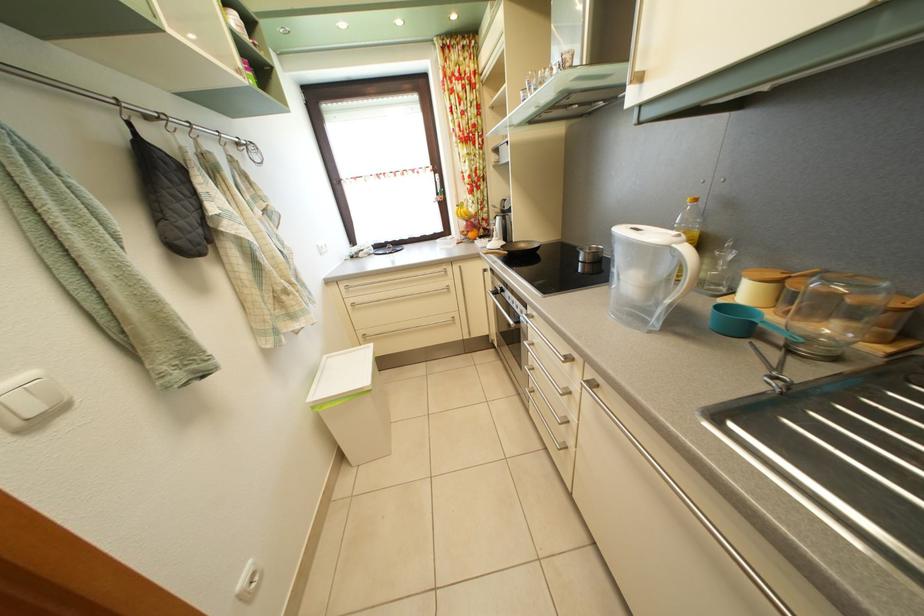
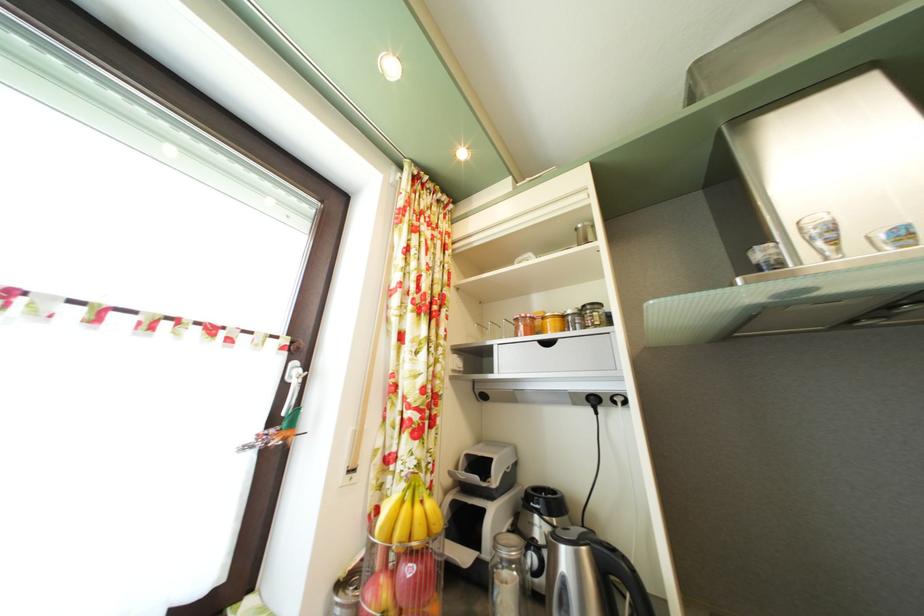
Locate, in the second image, the point that corresponds to point 445,182 in the first image.

(304, 371)